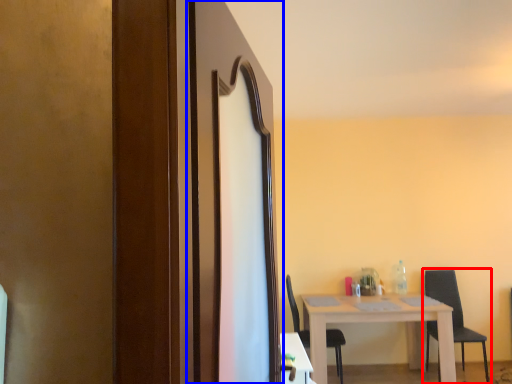
Question: Which object appears closest to the camera in this image, chair (highlighted by a red box) or screen door (highlighted by a blue box)?

Choices:
 (A) chair
 (B) screen door

Answer: (B)